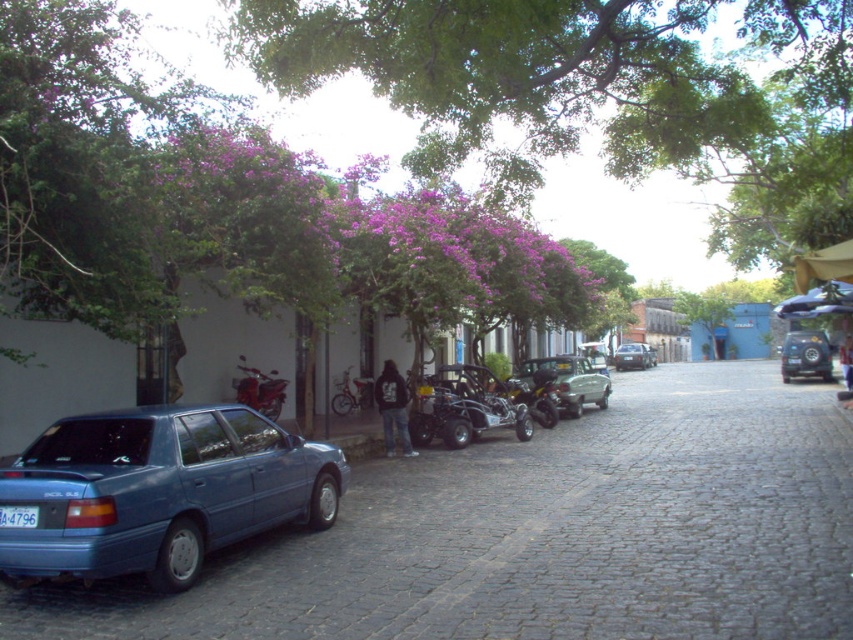
Is shiny red motorcycle at center-left to the right of metallic silver motorcycle at center from the viewer's perspective?

Incorrect, shiny red motorcycle at center-left is not on the right side of metallic silver motorcycle at center.

Is shiny red motorcycle at center-left behind metallic silver motorcycle at center?

No, shiny red motorcycle at center-left is in front of metallic silver motorcycle at center.

Who is more distant from viewer, [286,381] or [525,390]?

The point [525,390] is behind.

Find the location of `shiny red motorcycle at center-left`. shiny red motorcycle at center-left is located at coordinates (260, 390).

Can you confirm if matte blue sedan at lower left is taller than metallic silver go-kart at center?

Yes.

Can you confirm if matte blue sedan at lower left is positioned to the left of metallic silver go-kart at center?

Indeed, matte blue sedan at lower left is positioned on the left side of metallic silver go-kart at center.

What do you see at coordinates (160, 490) in the screenshot? Image resolution: width=853 pixels, height=640 pixels. I see `matte blue sedan at lower left` at bounding box center [160, 490].

Where is `matte blue sedan at lower left`? The height and width of the screenshot is (640, 853). matte blue sedan at lower left is located at coordinates (160, 490).

Does green matte car at center appear under metallic red motorcycle at center?

Actually, green matte car at center is above metallic red motorcycle at center.

Does green matte car at center appear on the right side of metallic red motorcycle at center?

Indeed, green matte car at center is positioned on the right side of metallic red motorcycle at center.

Which is in front, point (596, 396) or point (352, 390)?

Point (352, 390) is more forward.

Where is `green matte car at center`? The width and height of the screenshot is (853, 640). green matte car at center is located at coordinates point(569,381).